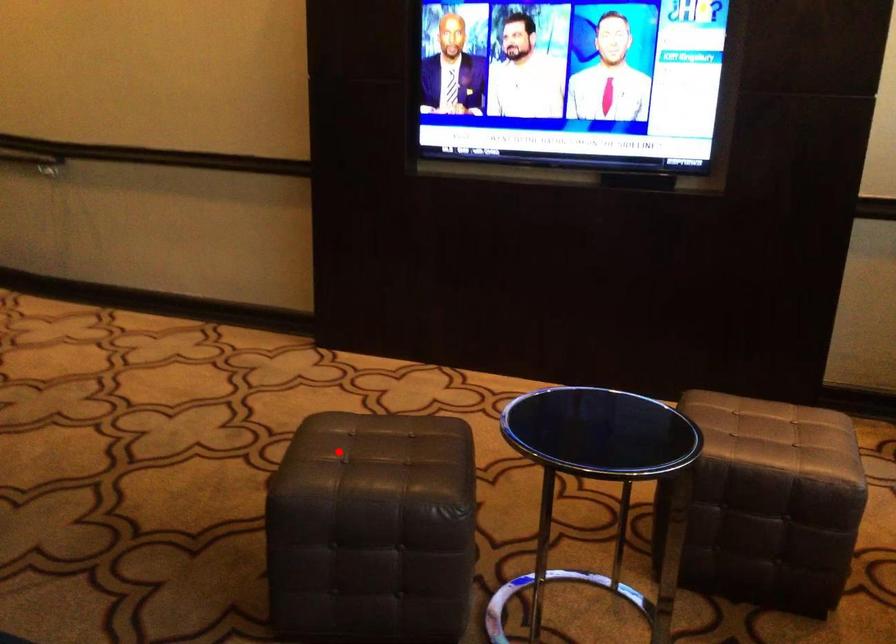
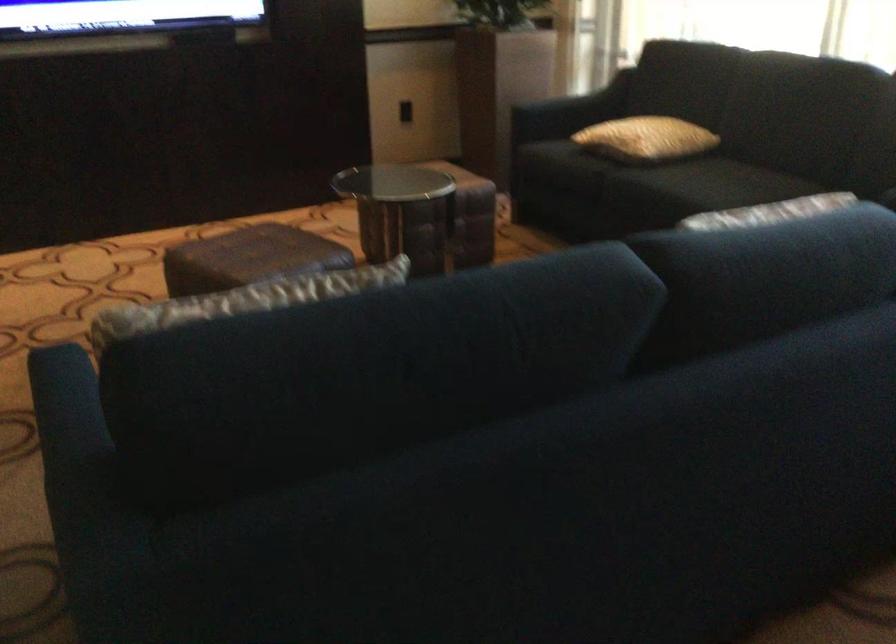
Question: I am providing you with two images of the same scene from different viewpoints. Image1 has a red point marked. In image2, the corresponding 3D location appears at what relative position? Reply with the corresponding letter.

Choices:
 (A) Closer
 (B) Farther

Answer: (B)